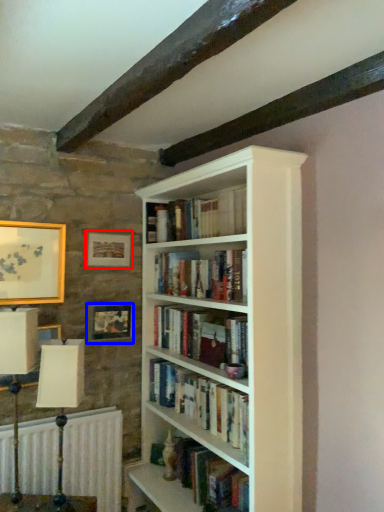
Question: Which point is further to the camera, picture frame (highlighted by a red box) or picture frame (highlighted by a blue box)?

Choices:
 (A) picture frame
 (B) picture frame

Answer: (A)